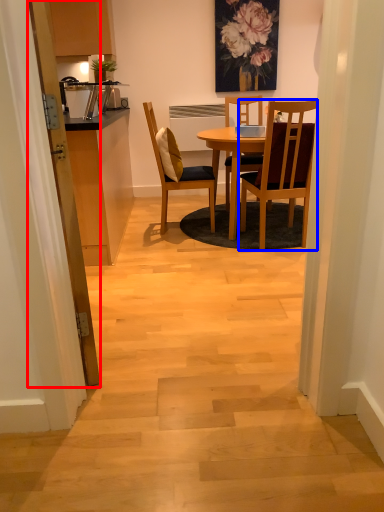
Question: Which object is further to the camera taking this photo, door (highlighted by a red box) or chair (highlighted by a blue box)?

Choices:
 (A) door
 (B) chair

Answer: (B)